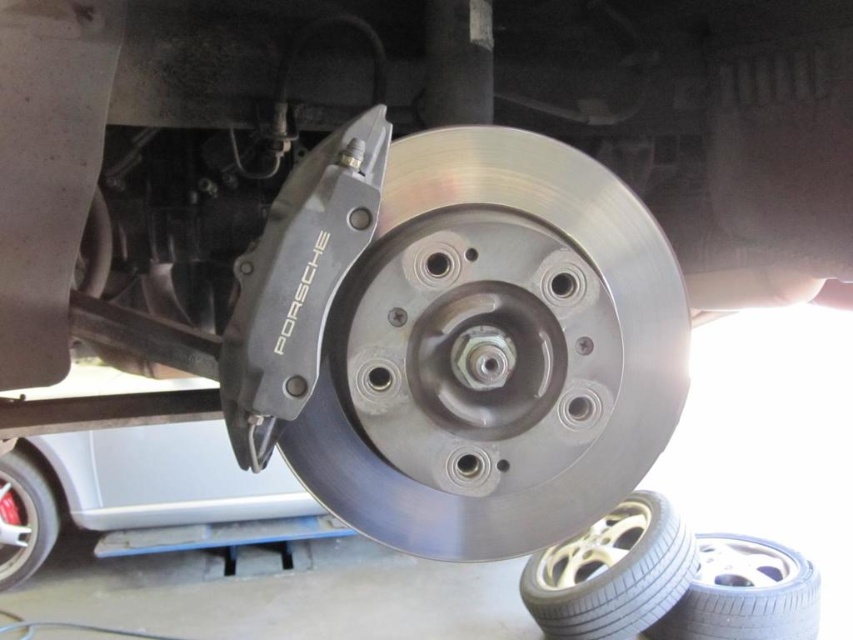
You are a mechanic working on a Porsche and need to access the white rubber tire at lower right. The tools you have are all within a 2.30 meters reach from your current position. Can you safely reach the tire without moving your position?

The white rubber tire at lower right is 2.40 meters away from camera. Since your tools are within 2.30 meters reach, you cannot safely reach the tire without moving your position.

You are a mechanic inspecting the brake system of a Porsche. You notice two points labeled as point 1 and point 2. Point 1 is at coordinate point (656, 524) and point 2 is at coordinate point (24, 532). Which point is closer to the camera?

Point 1 is closer to the camera than point 2.

You are a mechanic inspecting a Porsche vehicle. You notice the black rubber tire at lower right and the brushed metal tire at lower left. Which tire is located closer to the ground?

The black rubber tire at lower right is positioned under brushed metal tire at lower left, so it is closer to the ground.